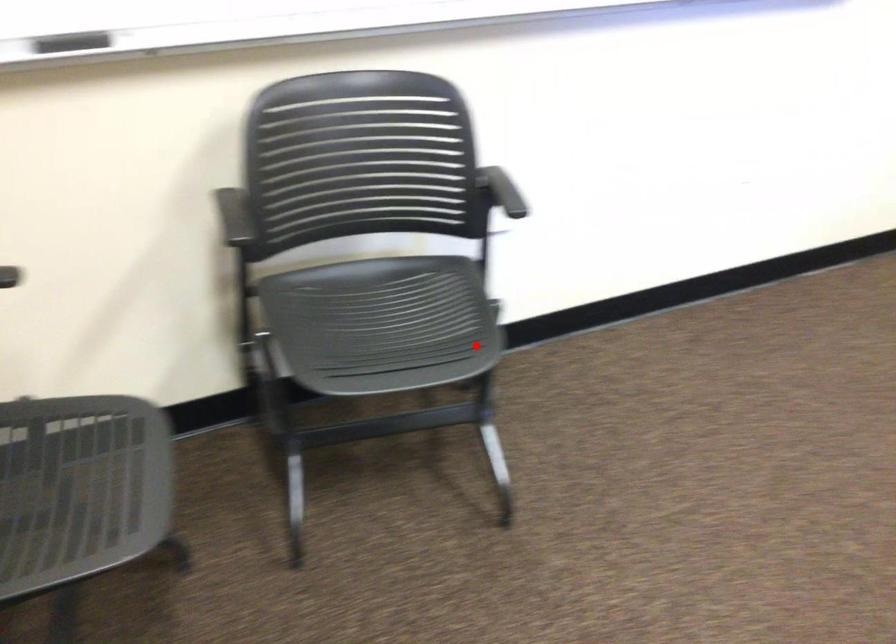
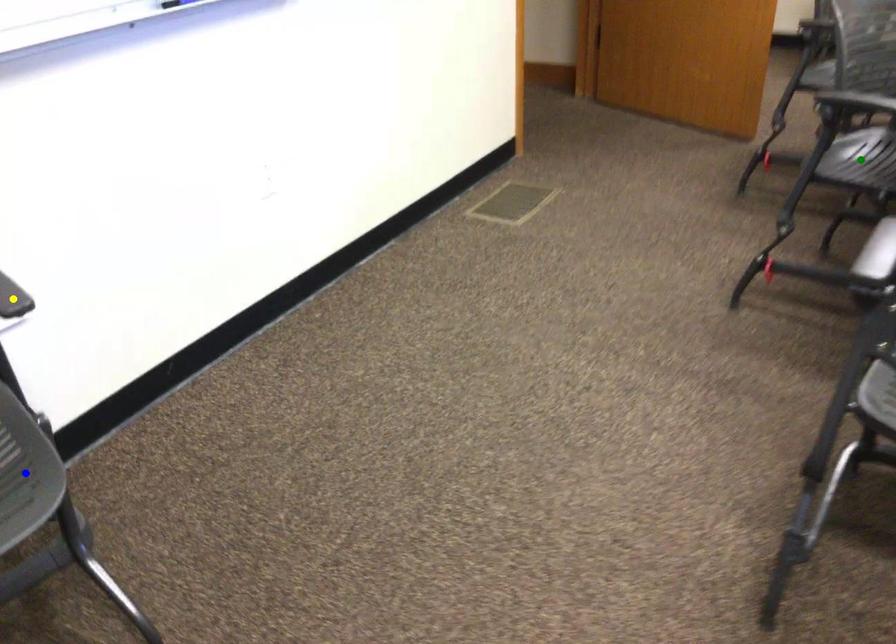
Question: I am providing you with two images of the same scene from different viewpoints. A red point is marked on the first image. You are given multiple points on the second image. In image 2, which mark is for the same physical point as the one in image 1?

Choices:
 (A) yellow point
 (B) green point
 (C) blue point

Answer: (C)